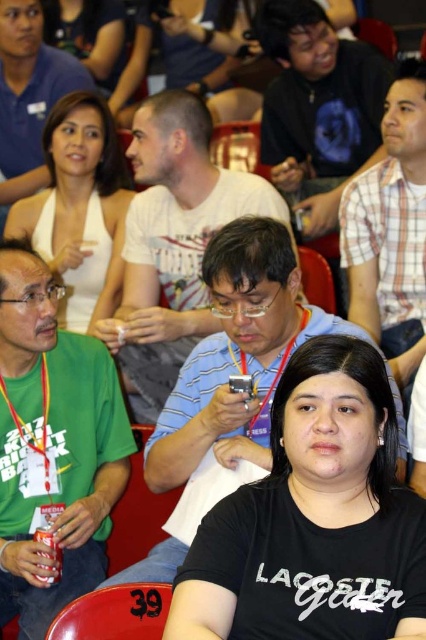
You are organizing a photo shoot and need to arrange the matte white shirt at center and the white plaid shirt at center based on their lengths. Which shirt should be placed in front to ensure the shorter one is visible?

The matte white shirt at center is shorter than the white plaid shirt at center, so placing the matte white shirt at center in front will ensure it remains visible.

You are organizing a photo shoot and want to ensure proper lighting for two white tops. The white matte halter top at upper left and the matte white tank top at upper center are both in the frame. Which top is closer to the camera?

The white matte halter top at upper left is positioned under the matte white tank top at upper center, so it is closer to the camera.